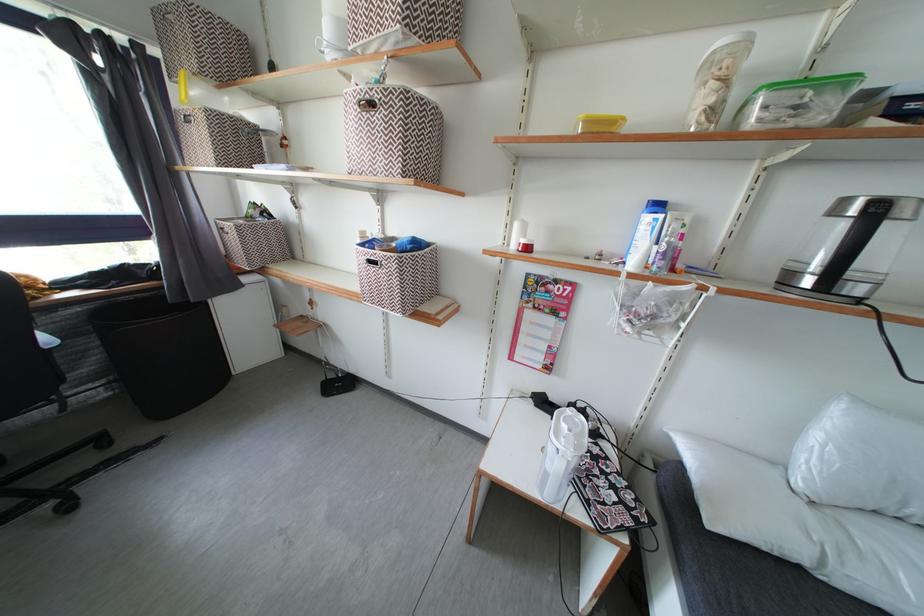
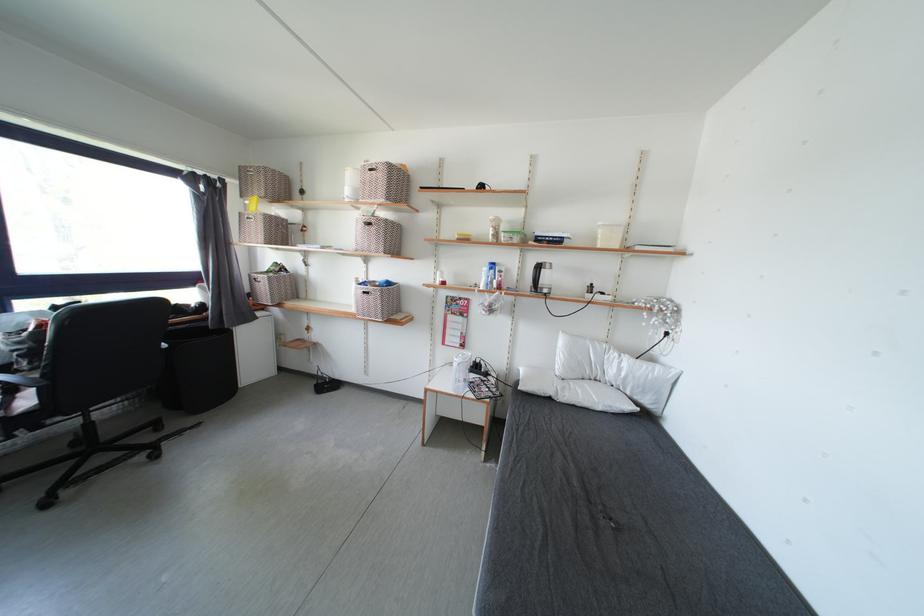
The point at (377,265) is marked in the first image. Where is the corresponding point in the second image?

(371, 297)